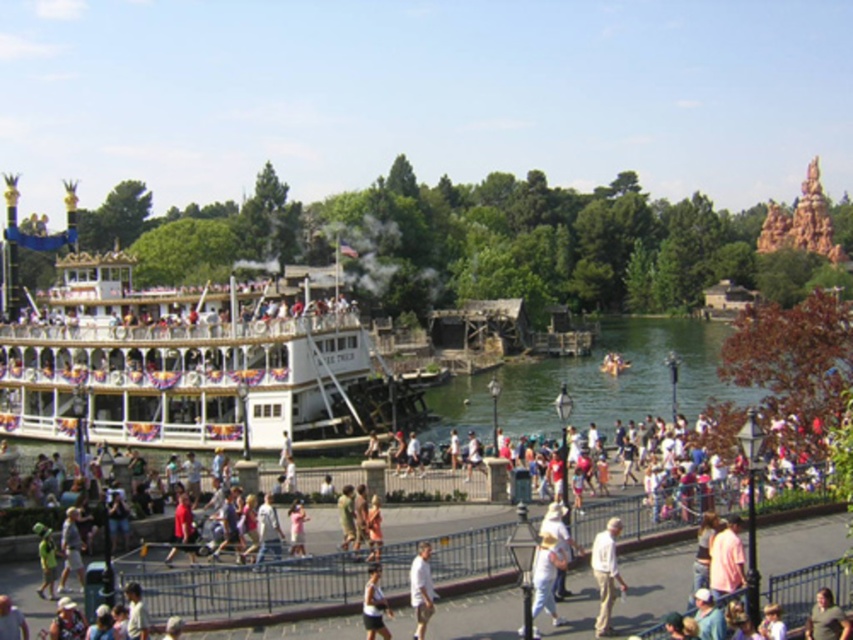
You are a photographer standing on the walkway and want to take a photo of the white cotton shirt at lower center without the white cotton crowd at center blocking it. Which direction should you move to ensure the crowd is out of the frame?

The white cotton crowd at center is positioned on the left side of the white cotton shirt at lower center. To avoid the crowd blocking the shirt, move to the right side of the shirt so the crowd is out of the frame.

You are standing at the bottom left corner of the image. You want to walk to the light brown leather jacket at center. Which direction should you go?

Since the light brown leather jacket at center is located at point 0.967 on the x axis and 0.970 on the y axis, you should move towards the right and slightly upwards from your current position at the bottom left corner.

You are a photographer at the theme park and want to take a photo of the light beige pants at center and the light beige shorts at center. Which clothing item is shorter in height?

The light beige pants at center is not as tall as light beige shorts at center, so the light beige pants at center is shorter in height.